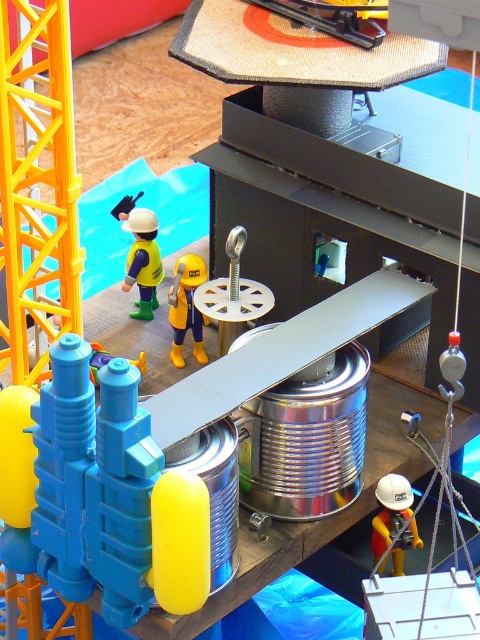
Question: Does matte blue cylinder at center have a smaller size compared to yellow matte construction worker at center?

Choices:
 (A) yes
 (B) no

Answer: (B)

Question: Can you confirm if white matte hard hat at lower right is thinner than yellow rubber boots at center?

Choices:
 (A) no
 (B) yes

Answer: (A)

Question: Is white matte hard hat at lower right thinner than yellow rubber boots at center?

Choices:
 (A) no
 (B) yes

Answer: (A)

Question: Among these objects, which one is farthest from the camera?

Choices:
 (A) yellow rubber boots at center
 (B) matte blue cylinder at center
 (C) yellow matte construction worker at center

Answer: (C)

Question: Which point is farther from the camera taking this photo?

Choices:
 (A) (117, 621)
 (B) (132, 282)
 (C) (192, 280)

Answer: (B)

Question: Based on their relative distances, which object is farther from the matte blue cylinder at center?

Choices:
 (A) yellow matte construction worker at center
 (B) white matte hard hat at lower right
 (C) yellow rubber boots at center

Answer: (A)